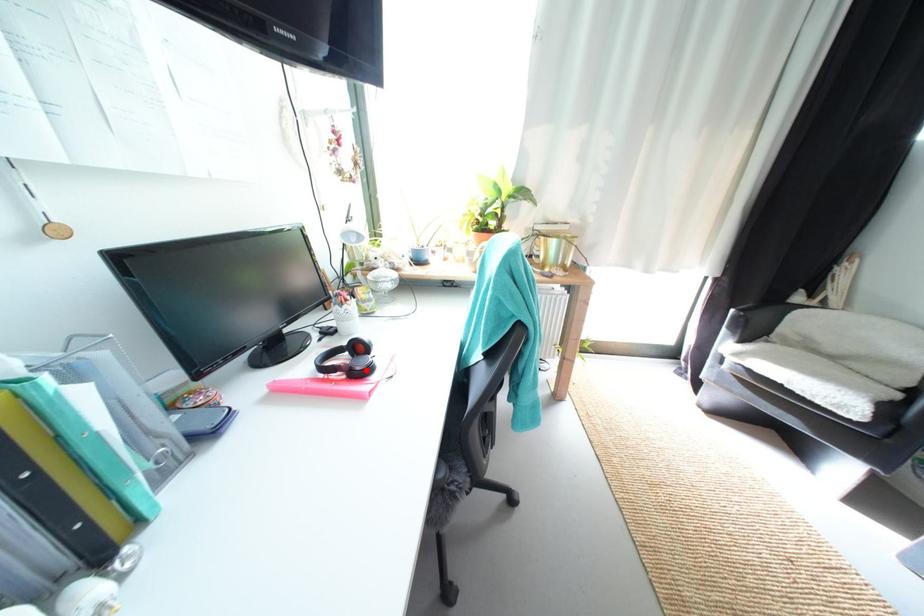
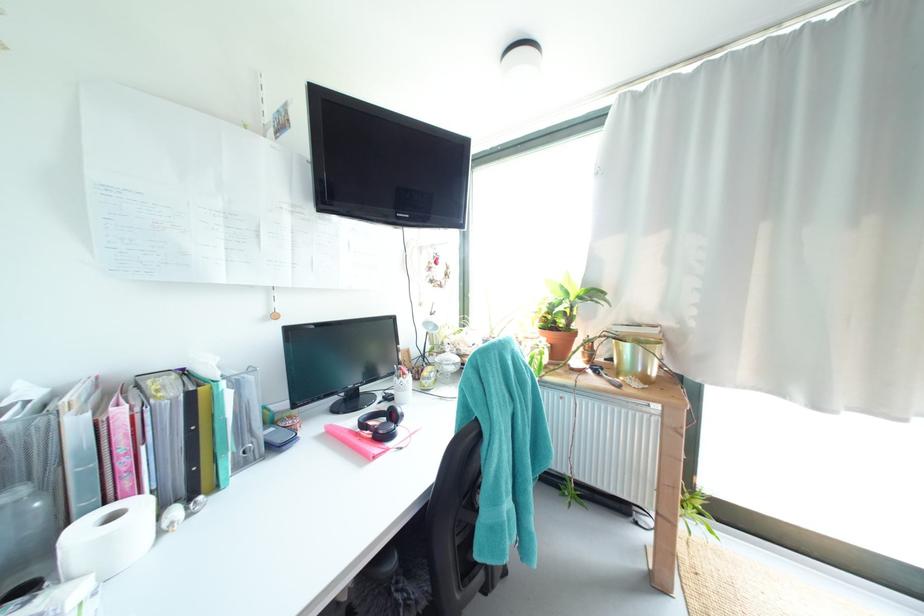
Question: I am providing you with two images of the same scene from different viewpoints. A red point is marked on the first image. At the location where the point appears in image 1, is it still visible in image 2?

Choices:
 (A) Yes
 (B) No

Answer: (A)